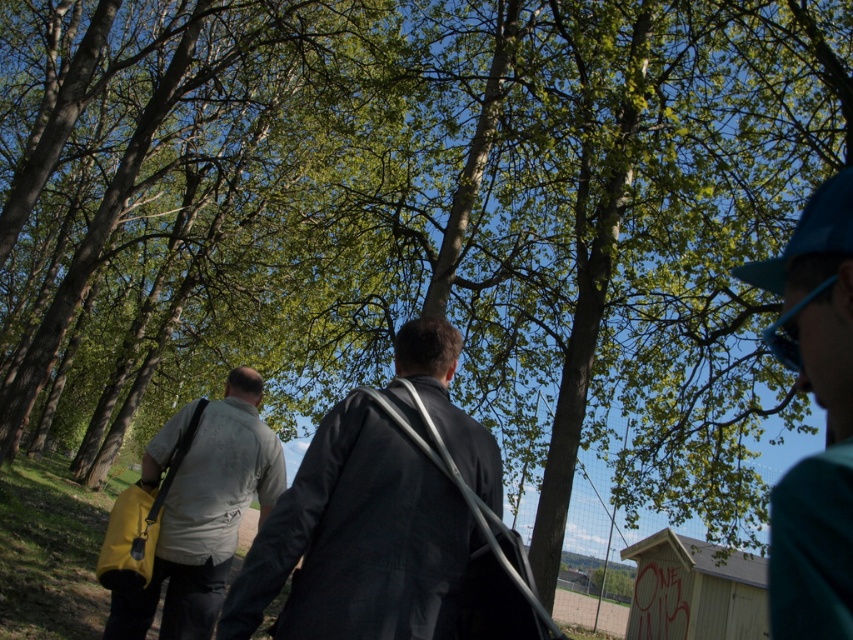
Based on the photo, who is positioned more to the left, dark gray suit at center or teal fabric cap at upper right?

From the viewer's perspective, dark gray suit at center appears more on the left side.

Is dark gray suit at center wider than teal fabric cap at upper right?

Yes, dark gray suit at center is wider than teal fabric cap at upper right.

Does point (421, 547) come closer to viewer compared to point (846, 275)?

No, it is not.

Find the location of a particular element. The width and height of the screenshot is (853, 640). dark gray suit at center is located at coordinates (357, 540).

Based on the photo, which of these two, dark gray suit at center or blue fabric baseball cap at upper right, stands taller?

Standing taller between the two is dark gray suit at center.

Which is behind, point (320, 508) or point (781, 288)?

Positioned behind is point (320, 508).

Does point (306, 464) lie in front of point (764, 289)?

No, (306, 464) is behind (764, 289).

Image resolution: width=853 pixels, height=640 pixels. I want to click on dark gray suit at center, so click(357, 540).

Who is positioned more to the left, light gray fabric shirt at center or blue fabric baseball cap at upper right?

From the viewer's perspective, light gray fabric shirt at center appears more on the left side.

This screenshot has height=640, width=853. I want to click on light gray fabric shirt at center, so click(x=206, y=516).

This screenshot has width=853, height=640. Identify the location of light gray fabric shirt at center. point(206,516).